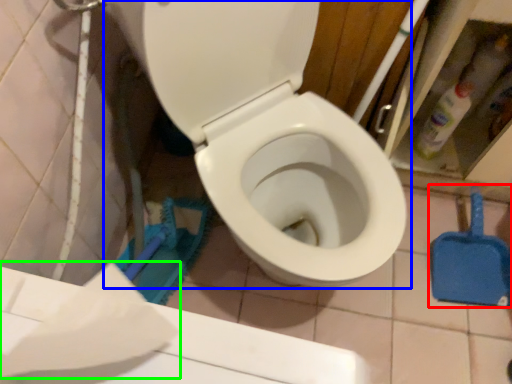
Question: Based on their relative distances, which object is farther from shovel (highlighted by a red box)? Choose from toilet (highlighted by a blue box) and toilet paper (highlighted by a green box).

Choices:
 (A) toilet
 (B) toilet paper

Answer: (B)